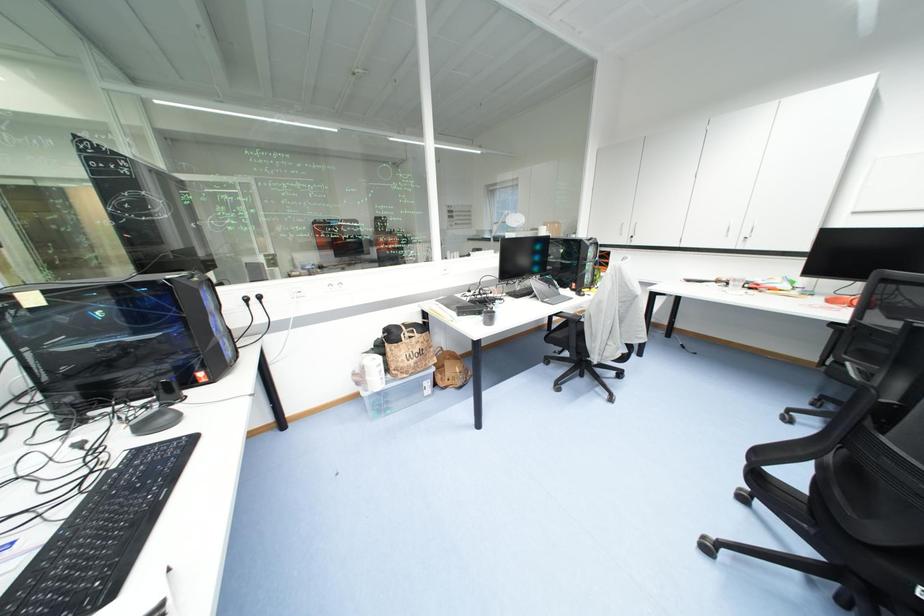
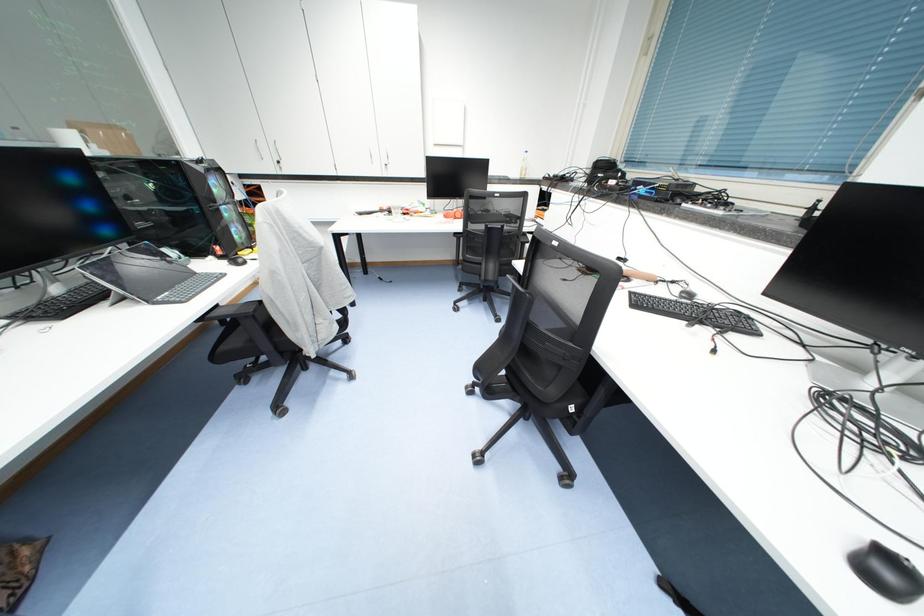
Based on the continuous images, in which direction is the camera rotating?

The camera rotated toward right-down.